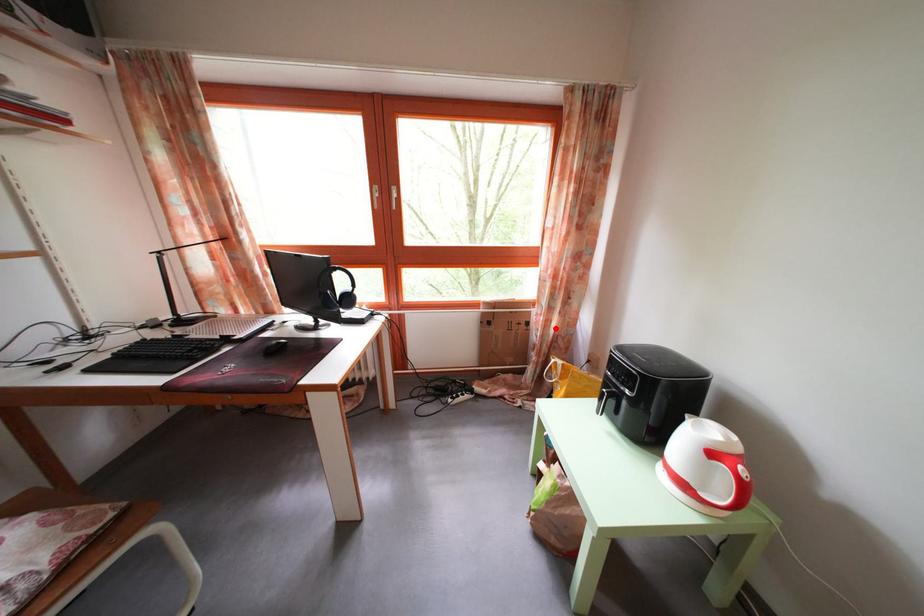
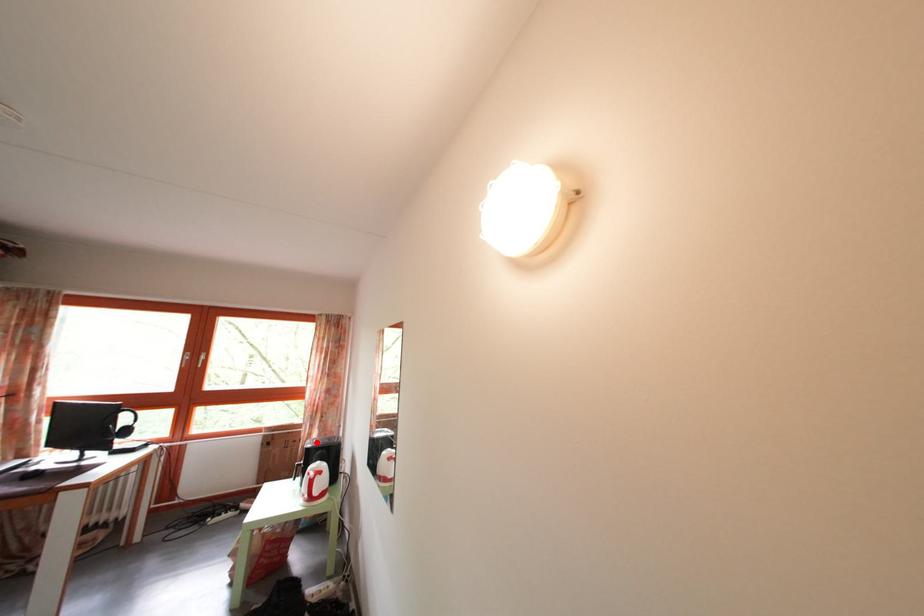
I am providing you with two images of the same scene from different viewpoints. A red point is marked on the first image and another point is marked on the second image. Is the marked point in image1 the same physical position as the marked point in image2?

Yes